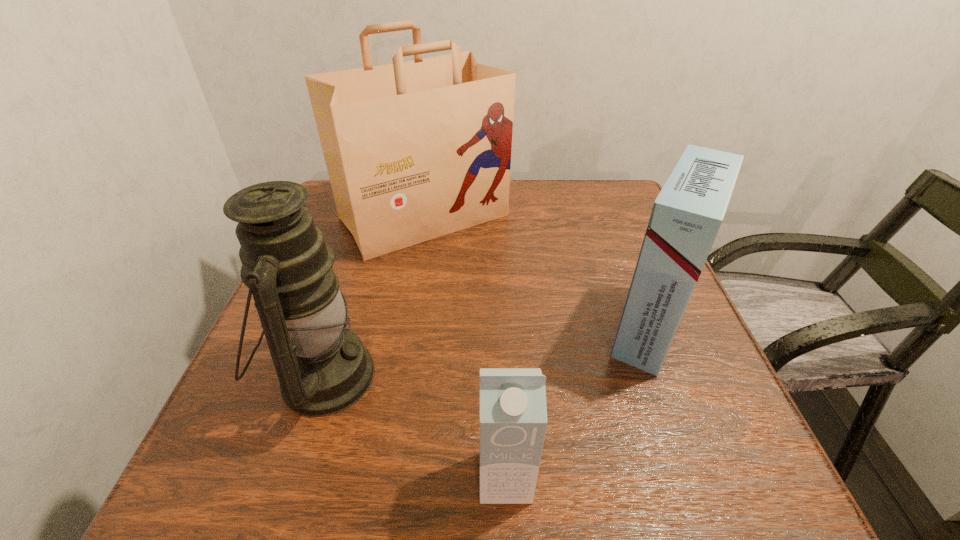
You are a GUI agent. You are given a task and a screenshot of the screen. Output one action in this format:
    pyautogui.click(x=<x>, y=<y>)
    Task: Click on the free space between the oil lamp and the shortest object
    Image resolution: width=960 pixels, height=540 pixels.
    Given the screenshot: What is the action you would take?
    pyautogui.click(x=415, y=427)

Find the location of a particular element. free space between the oil lamp and the cigarette case is located at coordinates (487, 352).

Find the location of a particular element. unoccupied position between the nearest object and the farthest object is located at coordinates (465, 347).

Where is `unoccupied position between the carton and the farthest object`? This screenshot has width=960, height=540. unoccupied position between the carton and the farthest object is located at coordinates (465, 347).

At what (x,y) coordinates should I click in order to perform the action: click on vacant area that lies between the cigarette case and the nearest object. Please return your answer as a coordinate pair (x, y). The height and width of the screenshot is (540, 960). Looking at the image, I should click on (578, 403).

Locate an element on the screen. This screenshot has height=540, width=960. vacant space that's between the oil lamp and the carton is located at coordinates (415, 427).

Find the location of a particular element. The image size is (960, 540). free space between the oil lamp and the rightmost object is located at coordinates (487, 352).

This screenshot has height=540, width=960. What are the coordinates of `blank region between the carton and the oil lamp` in the screenshot? It's located at (415, 427).

Where is `unoccupied position between the farthest object and the rightmost object`? The height and width of the screenshot is (540, 960). unoccupied position between the farthest object and the rightmost object is located at coordinates (537, 273).

The height and width of the screenshot is (540, 960). I want to click on object that stands as the third closest to the oil lamp, so click(686, 216).